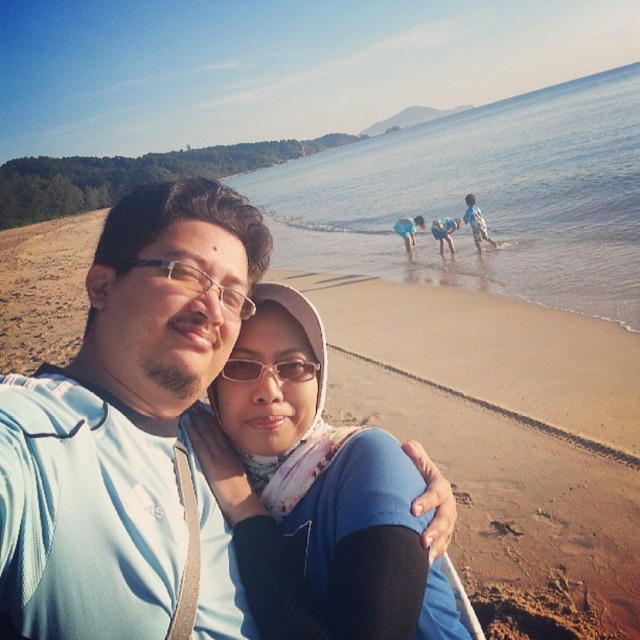
Question: Which point is farther to the camera?

Choices:
 (A) brown sandy beach at lower center
 (B) matte blue shirt at center

Answer: (A)

Question: Does blue water at center have a greater width compared to matte black glasses at center?

Choices:
 (A) yes
 (B) no

Answer: (A)

Question: Estimate the real-world distances between objects in this image. Which object is closer to the matte blue scarf at center?

Choices:
 (A) matte blue shirt at center
 (B) matte black glasses at center
 (C) brown sandy beach at lower center
 (D) transparent plastic glasses at center

Answer: (D)

Question: Is matte blue shirt at center thinner than matte blue scarf at center?

Choices:
 (A) no
 (B) yes

Answer: (B)

Question: Can you confirm if matte blue scarf at center is thinner than transparent plastic glasses at center?

Choices:
 (A) no
 (B) yes

Answer: (A)

Question: Which of the following is the closest to the observer?

Choices:
 (A) brown sandy beach at lower center
 (B) blue water at center
 (C) matte blue scarf at center

Answer: (C)